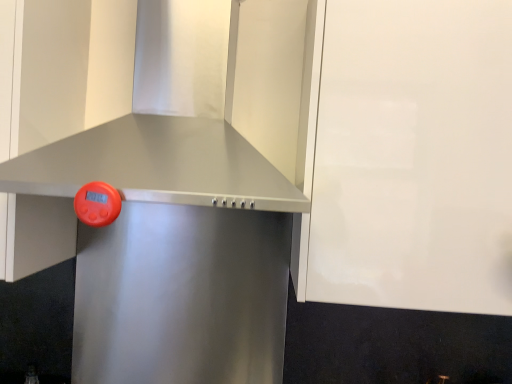
Question: Can you confirm if satin metallic range hood at center is thinner than white glossy cabinet at upper right?

Choices:
 (A) yes
 (B) no

Answer: (A)

Question: Can you confirm if satin metallic range hood at center is wider than white glossy cabinet at upper right?

Choices:
 (A) no
 (B) yes

Answer: (A)

Question: Is satin metallic range hood at center not within white glossy cabinet at upper right?

Choices:
 (A) no
 (B) yes

Answer: (B)

Question: Could you tell me if satin metallic range hood at center is turned towards white glossy cabinet at upper right?

Choices:
 (A) no
 (B) yes

Answer: (A)

Question: Is satin metallic range hood at center positioned before white glossy cabinet at upper right?

Choices:
 (A) no
 (B) yes

Answer: (A)

Question: In terms of width, does satin metallic vent at center look wider or thinner when compared to satin metallic range hood at center?

Choices:
 (A) thin
 (B) wide

Answer: (B)

Question: In terms of height, does satin metallic vent at center look taller or shorter compared to satin metallic range hood at center?

Choices:
 (A) short
 (B) tall

Answer: (B)

Question: Considering the positions of point (286, 198) and point (275, 339), is point (286, 198) closer or farther from the camera than point (275, 339)?

Choices:
 (A) farther
 (B) closer

Answer: (B)

Question: From a real-world perspective, is satin metallic vent at center physically located above or below satin metallic range hood at center?

Choices:
 (A) above
 (B) below

Answer: (A)

Question: In the image, is white glossy cabinet at upper right positioned in front of or behind satin metallic vent at center?

Choices:
 (A) front
 (B) behind

Answer: (B)

Question: In terms of height, does white glossy cabinet at upper right look taller or shorter compared to satin metallic vent at center?

Choices:
 (A) short
 (B) tall

Answer: (B)

Question: Visually, is white glossy cabinet at upper right positioned to the left or to the right of satin metallic vent at center?

Choices:
 (A) right
 (B) left

Answer: (A)

Question: Looking at their shapes, would you say white glossy cabinet at upper right is wider or thinner than satin metallic vent at center?

Choices:
 (A) thin
 (B) wide

Answer: (A)

Question: In the image, is satin metallic range hood at center positioned in front of or behind white glossy cabinet at upper right?

Choices:
 (A) behind
 (B) front

Answer: (A)

Question: Considering the positions of satin metallic range hood at center and white glossy cabinet at upper right in the image, is satin metallic range hood at center taller or shorter than white glossy cabinet at upper right?

Choices:
 (A) short
 (B) tall

Answer: (A)